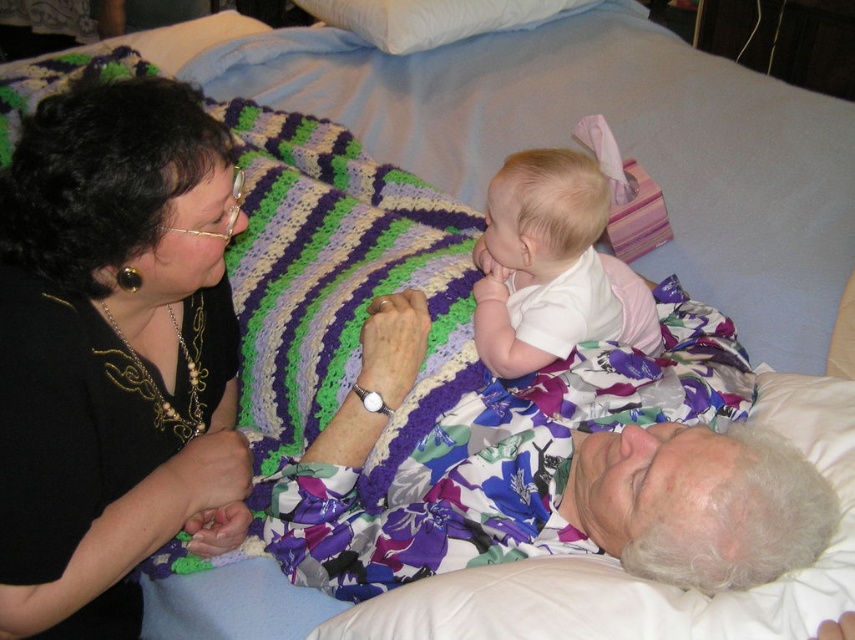
Question: Which object is positioned closest to the black fabric at upper left?

Choices:
 (A) white soft pillow at upper center
 (B) white soft baby at center

Answer: (B)

Question: Considering the relative positions of black fabric at upper left and white soft pillow at upper center in the image provided, where is black fabric at upper left located with respect to white soft pillow at upper center?

Choices:
 (A) right
 (B) left

Answer: (B)

Question: Among these points, which one is nearest to the camera?

Choices:
 (A) (570, 240)
 (B) (375, 45)

Answer: (A)

Question: Which point is farther to the camera?

Choices:
 (A) (x=623, y=280)
 (B) (x=298, y=4)
 (C) (x=24, y=124)

Answer: (B)

Question: Is black fabric at upper left to the right of white soft baby at center from the viewer's perspective?

Choices:
 (A) no
 (B) yes

Answer: (A)

Question: Observing the image, what is the correct spatial positioning of black fabric at upper left in reference to white soft pillow at upper center?

Choices:
 (A) above
 (B) below

Answer: (B)